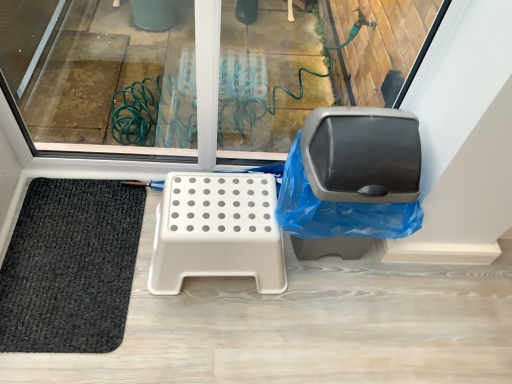
Where is `vacant area that lies to the right of beige plastic step stool at center`? vacant area that lies to the right of beige plastic step stool at center is located at coordinates (322, 314).